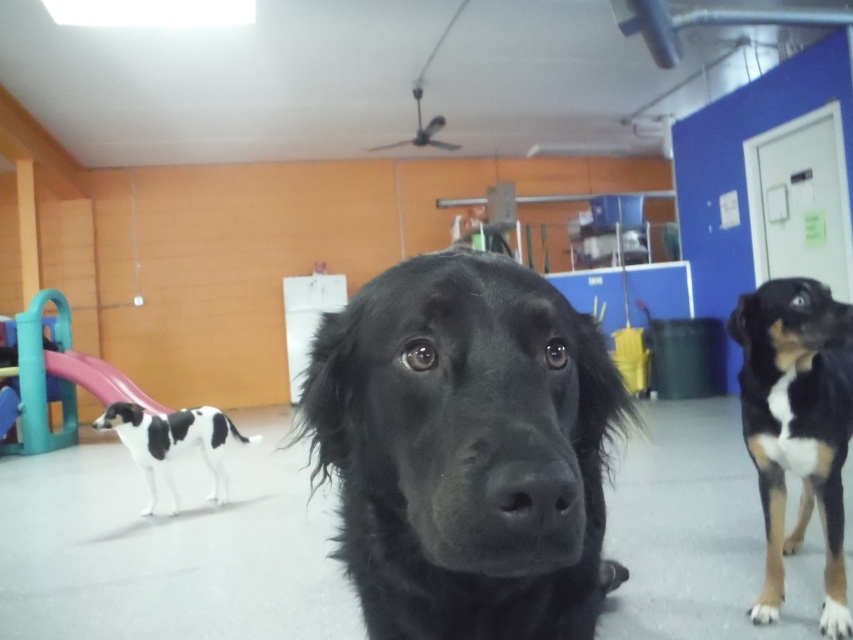
Can you confirm if brown and white fur dog at center is positioned below black and white fur dog at left?

Actually, brown and white fur dog at center is above black and white fur dog at left.

In the scene shown: Measure the distance from brown and white fur dog at center to black and white fur dog at left.

8.69 feet

This screenshot has height=640, width=853. In order to click on brown and white fur dog at center in this screenshot , I will do `click(798, 426)`.

Between black fur dog at center and black and white fur dog at left, which one is positioned lower?

black and white fur dog at left is lower down.

Is black fur dog at center wider than black and white fur dog at left?

Incorrect, black fur dog at center's width does not surpass black and white fur dog at left's.

Locate an element on the screen. black fur dog at center is located at coordinates (466, 449).

This screenshot has width=853, height=640. I want to click on black fur dog at center, so click(x=466, y=449).

Which is more to the left, black fur dog at center or brown and white fur dog at center?

Positioned to the left is black fur dog at center.

Between black fur dog at center and brown and white fur dog at center, which one is positioned higher?

black fur dog at center is higher up.

Is point (531, 576) farther from viewer compared to point (750, 452)?

No, it is not.

Where is `black fur dog at center`? The height and width of the screenshot is (640, 853). black fur dog at center is located at coordinates (466, 449).